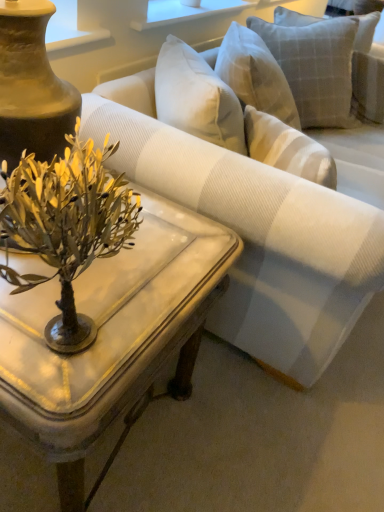
In order to click on unoccupied region to the right of metallic gold plant at center in this screenshot , I will do `click(168, 301)`.